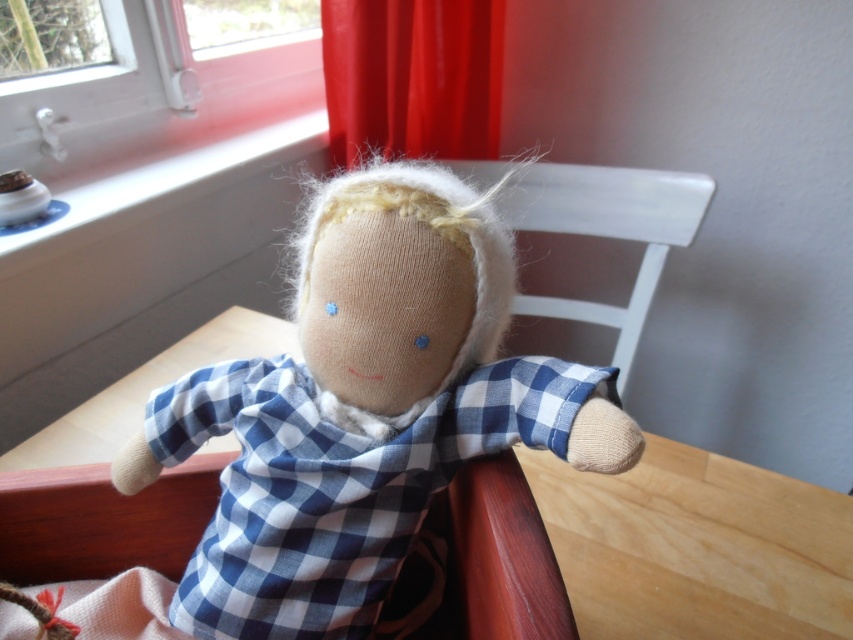
Question: Which object appears closest to the camera in this image?

Choices:
 (A) wooden table at center
 (B) smooth white window sill at upper left

Answer: (A)

Question: Which of the following is the closest to the observer?

Choices:
 (A) red velvet curtain at upper center
 (B) wooden table at center
 (C) white wood chair at center
 (D) woolen doll at center

Answer: (D)

Question: Can you confirm if smooth white window sill at upper left is positioned above white wood chair at center?

Choices:
 (A) no
 (B) yes

Answer: (B)

Question: Is wooden table at center positioned before white wood chair at center?

Choices:
 (A) yes
 (B) no

Answer: (A)

Question: Can you confirm if wooden table at center is thinner than red velvet curtain at upper center?

Choices:
 (A) yes
 (B) no

Answer: (B)

Question: Among these objects, which one is farthest from the camera?

Choices:
 (A) woolen doll at center
 (B) red velvet curtain at upper center
 (C) white wood chair at center

Answer: (B)